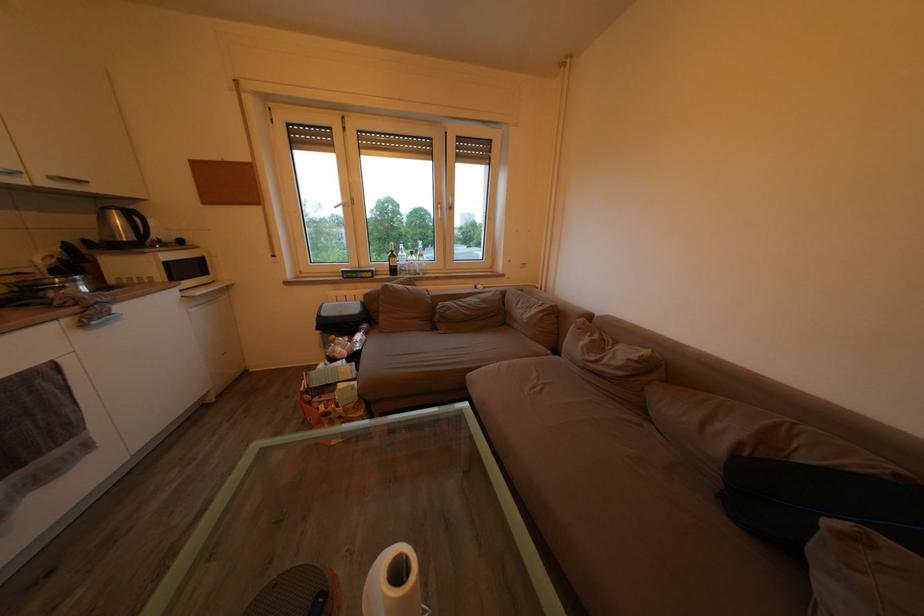
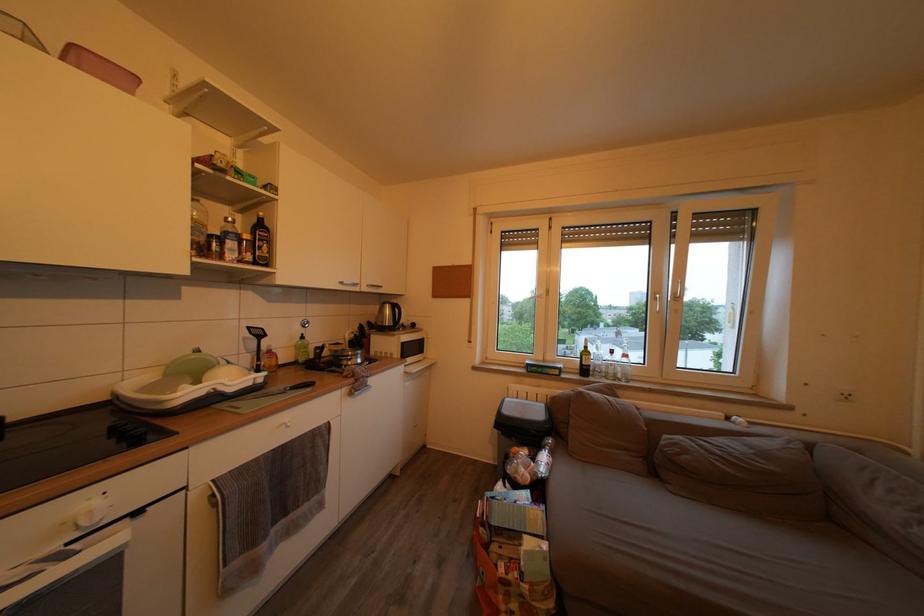
The point at (419, 275) is marked in the first image. Where is the corresponding point in the second image?

(618, 378)